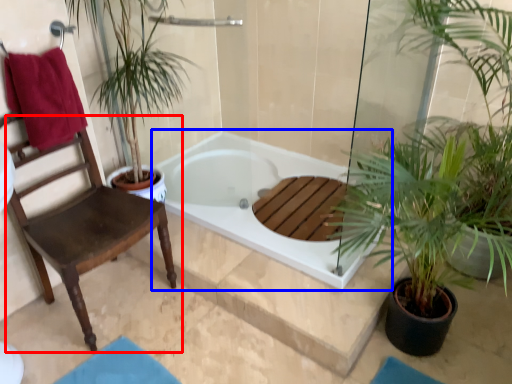
Question: Which of the following is the farthest to the observer, chair (highlighted by a red box) or bathtub (highlighted by a blue box)?

Choices:
 (A) chair
 (B) bathtub

Answer: (B)